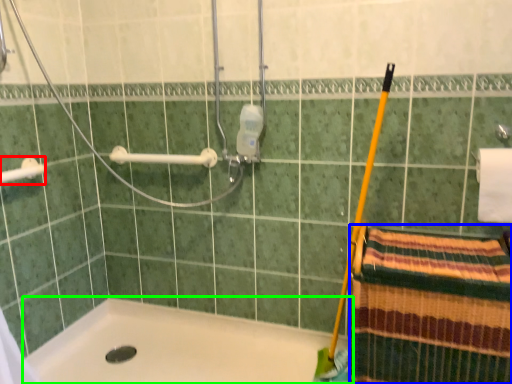
Question: Which object is the closest to the towel bar (highlighted by a red box)? Choose among these: beach towel (highlighted by a blue box) or bathtub (highlighted by a green box).

Choices:
 (A) beach towel
 (B) bathtub

Answer: (B)